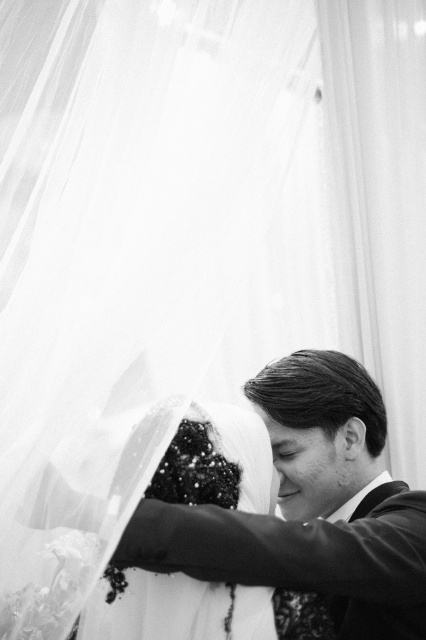
Question: Which point is farther to the camera?

Choices:
 (A) sequined fabric veil at center
 (B) smooth black suit at center

Answer: (A)

Question: Is smooth black suit at center thinner than sequined fabric veil at center?

Choices:
 (A) yes
 (B) no

Answer: (B)

Question: Which point is closer to the camera?

Choices:
 (A) (371, 621)
 (B) (265, 484)

Answer: (B)

Question: Which object is closer to the camera taking this photo?

Choices:
 (A) smooth black suit at center
 (B) sequined fabric veil at center

Answer: (A)

Question: Can you confirm if smooth black suit at center is positioned below sequined fabric veil at center?

Choices:
 (A) yes
 (B) no

Answer: (A)

Question: Is smooth black suit at center positioned in front of sequined fabric veil at center?

Choices:
 (A) no
 (B) yes

Answer: (B)